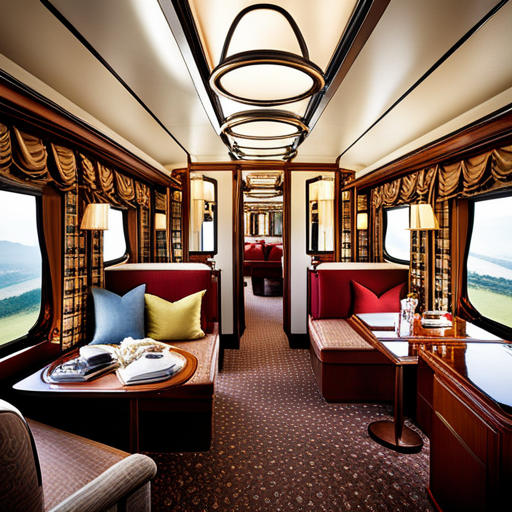
Image resolution: width=512 pixels, height=512 pixels. I want to click on pillows, so click(x=362, y=298), click(x=175, y=317), click(x=110, y=316).